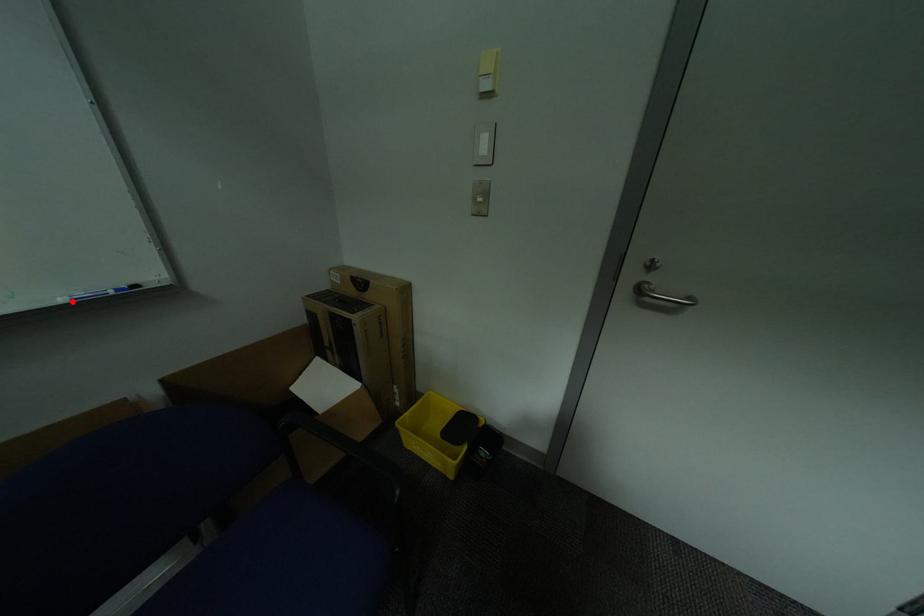
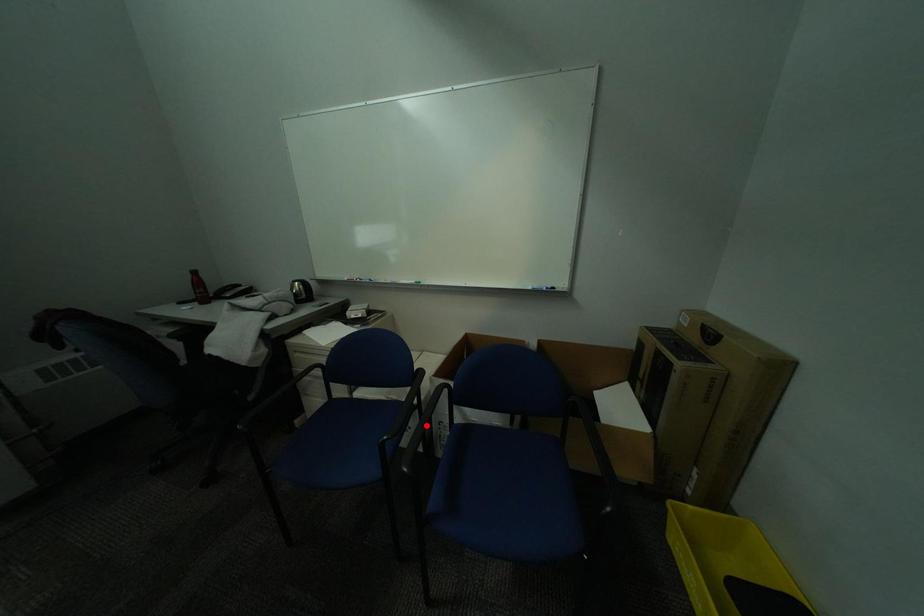
I am providing you with two images of the same scene from different viewpoints. A red point is marked on the first image and another point is marked on the second image. Are the points marked in image1 and image2 representing the same 3D position?

No